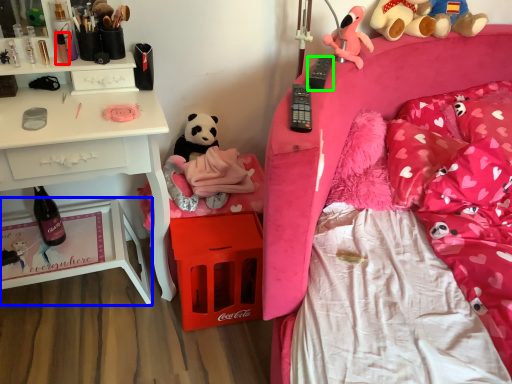
Question: Which is farther away from toiletry (highlighted by a red box)? nightstand (highlighted by a blue box) or remote control (highlighted by a green box)?

Choices:
 (A) nightstand
 (B) remote control

Answer: (B)